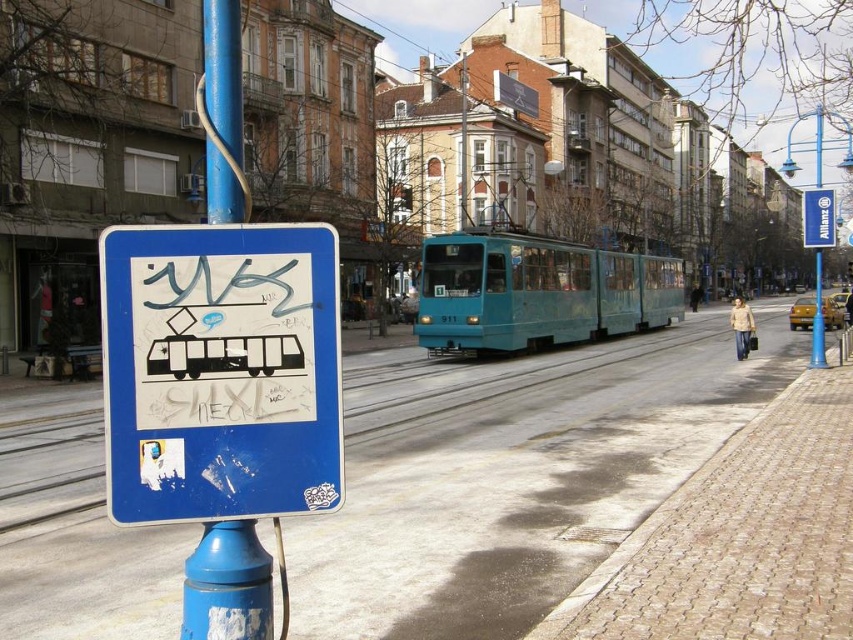
Question: Is brick pavement at lower right wider than blue painted metal pole at left?

Choices:
 (A) no
 (B) yes

Answer: (B)

Question: Can you confirm if brick pavement at lower right is positioned to the left of blue plastic sign at left?

Choices:
 (A) yes
 (B) no

Answer: (B)

Question: Which point is closer to the camera taking this photo?

Choices:
 (A) (235, 364)
 (B) (819, 234)

Answer: (A)

Question: Which point appears farthest from the camera in this image?

Choices:
 (A) (804, 192)
 (B) (229, 221)
 (C) (140, 371)

Answer: (A)

Question: Which object is positioned closest to the blue plastic sign at left?

Choices:
 (A) blue plastic sign at upper center
 (B) blue painted metal pole at left

Answer: (B)

Question: Is blue plastic sign at left positioned at the back of blue painted metal pole at left?

Choices:
 (A) yes
 (B) no

Answer: (B)